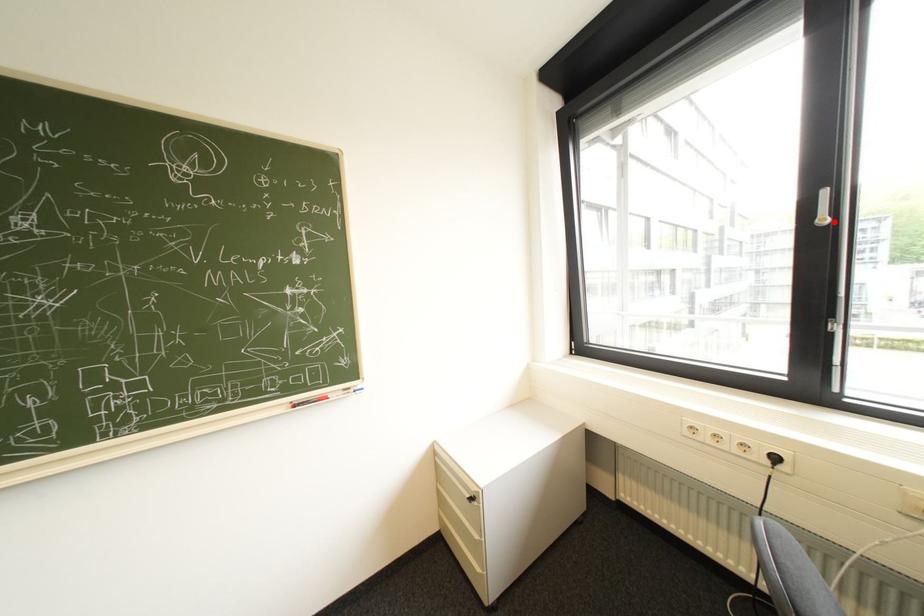
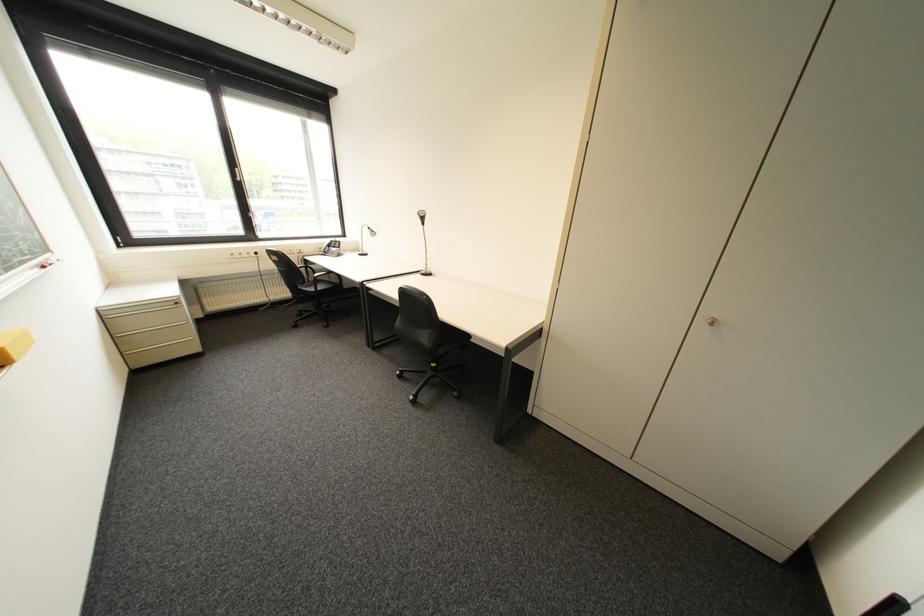
Where in the second image is the point corresponding to the highlighted location from the first image?

(249, 180)